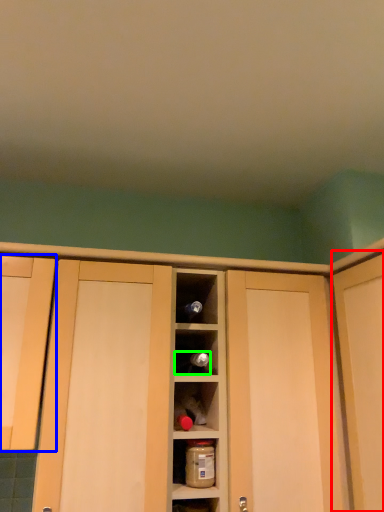
Question: Which object is the closest to the door (highlighted by a red box)? Choose among these: cabinetry (highlighted by a blue box) or wine bottle (highlighted by a green box).

Choices:
 (A) cabinetry
 (B) wine bottle

Answer: (B)